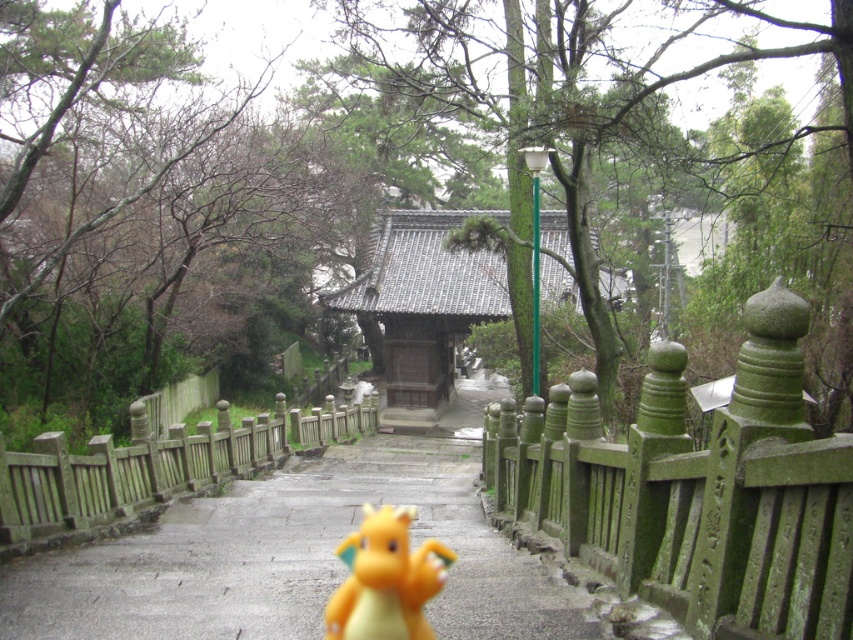
Question: Based on their relative distances, which object is nearer to the yellow rubber dragon at center?

Choices:
 (A) green mossy wood fence at left
 (B) green mossy stone fence at right

Answer: (B)

Question: Considering the relative positions of green mossy stone fence at right and green mossy wood fence at left in the image provided, where is green mossy stone fence at right located with respect to green mossy wood fence at left?

Choices:
 (A) below
 (B) above

Answer: (B)

Question: Considering the real-world distances, which object is farthest from the green mossy wood fence at left?

Choices:
 (A) yellow rubber dragon at center
 (B) green mossy stone fence at right

Answer: (A)

Question: Is green mossy stone fence at right wider than green mossy wood fence at left?

Choices:
 (A) yes
 (B) no

Answer: (B)

Question: Which object is positioned closest to the green mossy wood fence at left?

Choices:
 (A) green mossy stone fence at right
 (B) yellow rubber dragon at center

Answer: (A)

Question: Can you confirm if green mossy stone fence at right is bigger than yellow rubber dragon at center?

Choices:
 (A) no
 (B) yes

Answer: (B)